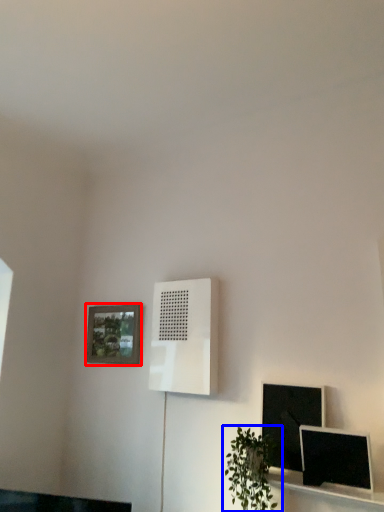
Question: Which of the following is the closest to the observer, picture frame (highlighted by a red box) or houseplant (highlighted by a blue box)?

Choices:
 (A) picture frame
 (B) houseplant

Answer: (B)